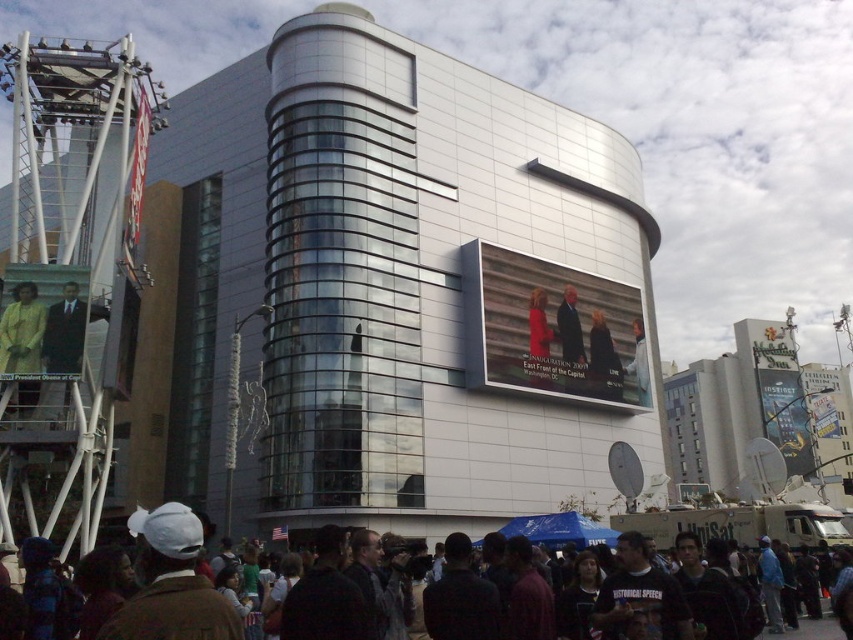
Question: Which of the following is the farthest from the observer?

Choices:
 (A) (146, 141)
 (B) (637, 349)
 (C) (606, 339)

Answer: (B)

Question: Is dark blue suit at center smaller than dark brown leather jacket at lower center?

Choices:
 (A) no
 (B) yes

Answer: (B)

Question: In this image, where is yellow fabric portrait at upper left located relative to matte yellow jacket at left?

Choices:
 (A) right
 (B) left

Answer: (B)

Question: Estimate the real-world distances between objects in this image. Which object is farther from the matte black suit at left?

Choices:
 (A) matte yellow jacket at left
 (B) metallic coca-cola sign at upper left
 (C) smooth black suit at center
 (D) light brown leather jacket at upper center

Answer: (D)

Question: Estimate the real-world distances between objects in this image. Which object is closer to the matte black suit at left?

Choices:
 (A) matte digital display at center
 (B) matte black suit at center
 (C) dark brown leather jacket at lower center

Answer: (C)

Question: In this image, where is yellow fabric portrait at upper left located relative to matte black suit at left?

Choices:
 (A) right
 (B) left

Answer: (B)